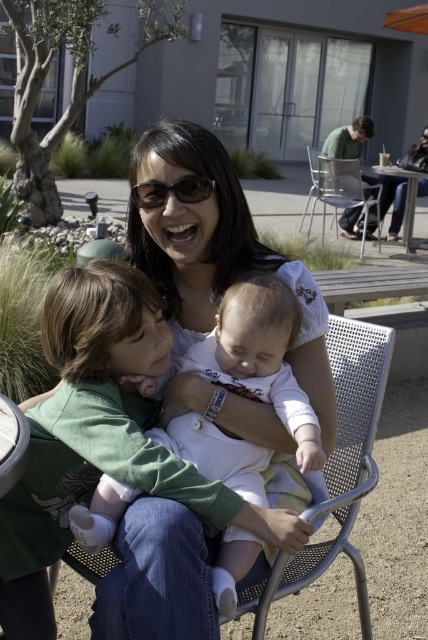
Does metallic silver chair at upper center have a smaller size compared to matte black sunglasses at center?

No, metallic silver chair at upper center is not smaller than matte black sunglasses at center.

Does point (341, 193) come in front of point (198, 186)?

That is False.

This screenshot has height=640, width=428. What do you see at coordinates (341, 192) in the screenshot? I see `metallic silver chair at upper center` at bounding box center [341, 192].

Where is `metallic silver chair at upper center`? This screenshot has width=428, height=640. metallic silver chair at upper center is located at coordinates (341, 192).

Between point (220, 349) and point (157, 204), which one is positioned in front?

Point (220, 349) is more forward.

Between white matte baby at center and matte black sunglasses at center, which one has less height?

matte black sunglasses at center

Is point (211, 476) positioned in front of point (181, 202)?

That is True.

Where is `white matte baby at center`? white matte baby at center is located at coordinates (259, 356).

Is white matte baby at center above metallic silver chair at upper center?

No.

Is the position of white matte baby at center more distant than that of metallic silver chair at upper center?

No, it is in front of metallic silver chair at upper center.

Image resolution: width=428 pixels, height=640 pixels. I want to click on white matte baby at center, so click(259, 356).

Identify the location of white matte baby at center. (259, 356).